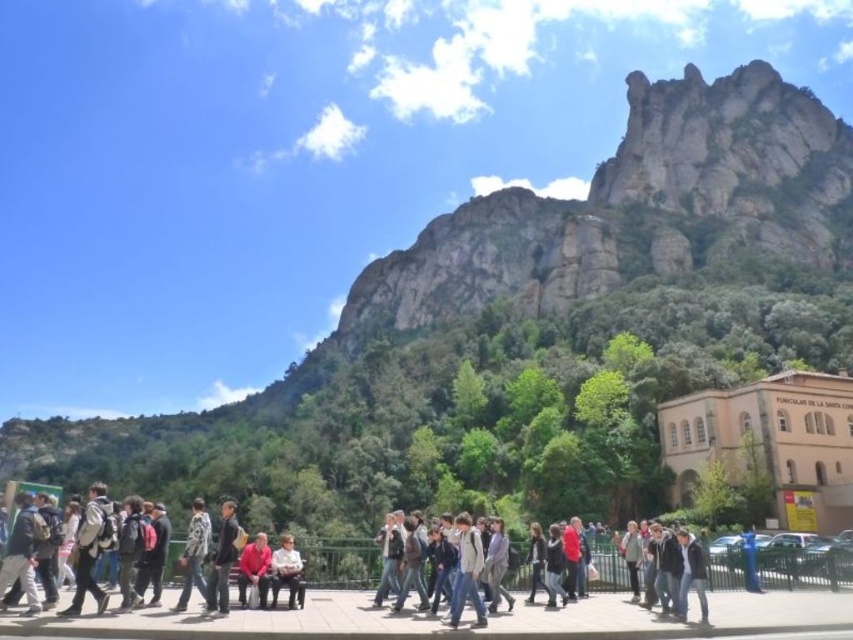
Between light brown leather jacket at center and light gray jacket at center, which one is positioned lower?

Positioned lower is light brown leather jacket at center.

At what (x,y) coordinates should I click in order to perform the action: click on light brown leather jacket at center. Please return your answer as a coordinate pair (x, y). Looking at the image, I should click on (287, 572).

You are a GUI agent. You are given a task and a screenshot of the screen. Output one action in this format:
    pyautogui.click(x=<x>, y=<y>)
    Task: Click on the light brown leather jacket at center
    This screenshot has width=853, height=640.
    Given the screenshot: What is the action you would take?
    pyautogui.click(x=287, y=572)

Locate an element on the screen. The image size is (853, 640). light brown leather jacket at center is located at coordinates (287, 572).

From the picture: Who is positioned more to the right, matte red shirt at center or light gray jacket at center?

Positioned to the right is light gray jacket at center.

Is matte red shirt at center taller than light gray jacket at center?

Correct, matte red shirt at center is much taller as light gray jacket at center.

What do you see at coordinates (254, 568) in the screenshot? I see `matte red shirt at center` at bounding box center [254, 568].

The image size is (853, 640). Find the location of `matte red shirt at center`. matte red shirt at center is located at coordinates click(x=254, y=568).

Locate an element on the screen. This screenshot has width=853, height=640. matte red shirt at center is located at coordinates (254, 568).

Does matte red shirt at center appear on the right side of dark gray sweater at center?

Incorrect, matte red shirt at center is not on the right side of dark gray sweater at center.

Describe the element at coordinates (254, 568) in the screenshot. I see `matte red shirt at center` at that location.

This screenshot has height=640, width=853. Identify the location of matte red shirt at center. (254, 568).